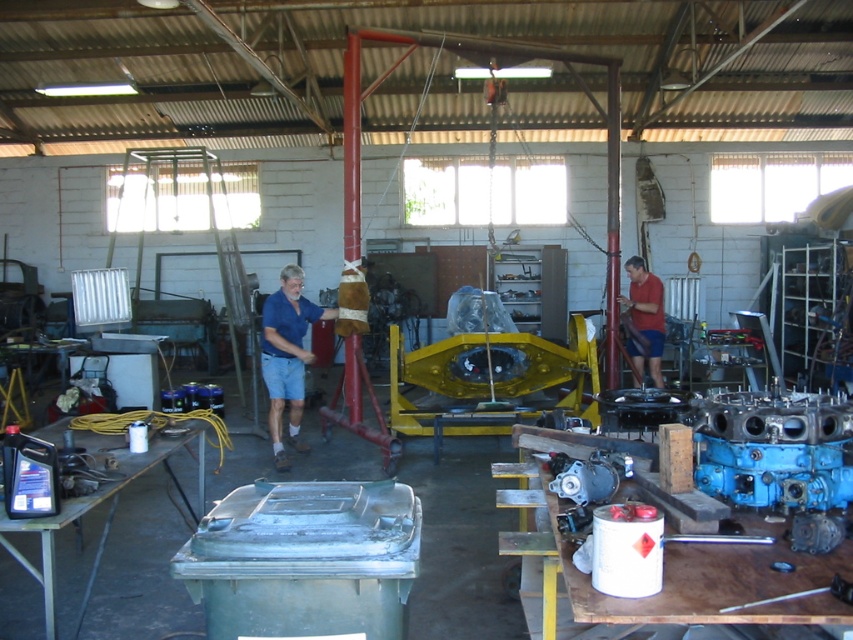
Question: Which of the following is the farthest from the observer?

Choices:
 (A) blue fabric shirt at center
 (B) red matte shirt at center
 (C) black plastic workbench at lower left

Answer: (B)

Question: Among these points, which one is farthest from the camera?

Choices:
 (A) (51, 566)
 (B) (641, 259)
 (C) (306, 300)

Answer: (B)

Question: Is blue fabric shirt at center to the left of red matte shirt at center from the viewer's perspective?

Choices:
 (A) no
 (B) yes

Answer: (B)

Question: Which point is closer to the camera taking this photo?

Choices:
 (A) (659, 378)
 (B) (326, 320)
 (C) (0, 524)

Answer: (C)

Question: Is blue fabric shirt at center thinner than red matte shirt at center?

Choices:
 (A) yes
 (B) no

Answer: (B)

Question: Can you confirm if black plastic workbench at lower left is wider than red matte shirt at center?

Choices:
 (A) no
 (B) yes

Answer: (B)